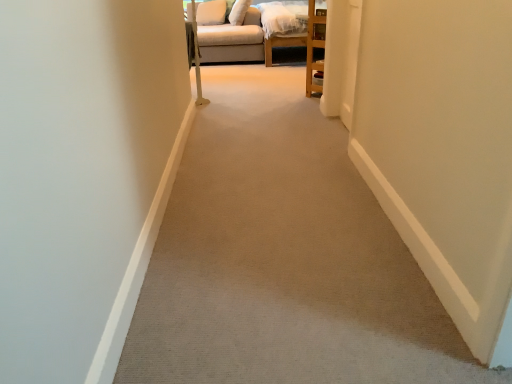
Question: Is beige fabric pillow at upper center, marked as the 2th pillow in a left-to-right arrangement, further to the viewer compared to white fabric pillow at upper center, the second pillow viewed from the right?

Choices:
 (A) yes
 (B) no

Answer: (B)

Question: Can you confirm if beige fabric pillow at upper center, which is the 1th pillow in right-to-left order, is smaller than white fabric pillow at upper center, marked as the 1th pillow in a left-to-right arrangement?

Choices:
 (A) yes
 (B) no

Answer: (B)

Question: Can you confirm if beige fabric pillow at upper center, marked as the 2th pillow in a left-to-right arrangement, is wider than white fabric pillow at upper center, the second pillow viewed from the right?

Choices:
 (A) no
 (B) yes

Answer: (A)

Question: From the image's perspective, is beige fabric pillow at upper center, marked as the 2th pillow in a left-to-right arrangement, below white fabric pillow at upper center, marked as the 1th pillow in a left-to-right arrangement?

Choices:
 (A) no
 (B) yes

Answer: (B)

Question: Is beige fabric pillow at upper center, which is the 1th pillow in right-to-left order, far away from white fabric pillow at upper center, marked as the 1th pillow in a left-to-right arrangement?

Choices:
 (A) yes
 (B) no

Answer: (B)

Question: Can you confirm if beige fabric pillow at upper center, marked as the 2th pillow in a left-to-right arrangement, is shorter than white fabric pillow at upper center, the second pillow viewed from the right?

Choices:
 (A) yes
 (B) no

Answer: (A)

Question: Is beige carpet at center not within white fabric pillow at upper center, marked as the 1th pillow in a left-to-right arrangement?

Choices:
 (A) yes
 (B) no

Answer: (A)

Question: From the image's perspective, is beige carpet at center located beneath white fabric pillow at upper center, marked as the 1th pillow in a left-to-right arrangement?

Choices:
 (A) no
 (B) yes

Answer: (B)

Question: Is beige carpet at center further to camera compared to white fabric pillow at upper center, marked as the 1th pillow in a left-to-right arrangement?

Choices:
 (A) no
 (B) yes

Answer: (A)

Question: Could you tell me if beige carpet at center is turned towards white fabric pillow at upper center, marked as the 1th pillow in a left-to-right arrangement?

Choices:
 (A) no
 (B) yes

Answer: (A)

Question: Does beige carpet at center have a larger size compared to white fabric pillow at upper center, marked as the 1th pillow in a left-to-right arrangement?

Choices:
 (A) yes
 (B) no

Answer: (A)

Question: Can you confirm if beige carpet at center is positioned to the right of white fabric pillow at upper center, the second pillow viewed from the right?

Choices:
 (A) no
 (B) yes

Answer: (B)

Question: Considering the relative sizes of beige carpet at center and beige fabric pillow at upper center, marked as the 2th pillow in a left-to-right arrangement, in the image provided, is beige carpet at center smaller than beige fabric pillow at upper center, marked as the 2th pillow in a left-to-right arrangement,?

Choices:
 (A) yes
 (B) no

Answer: (B)